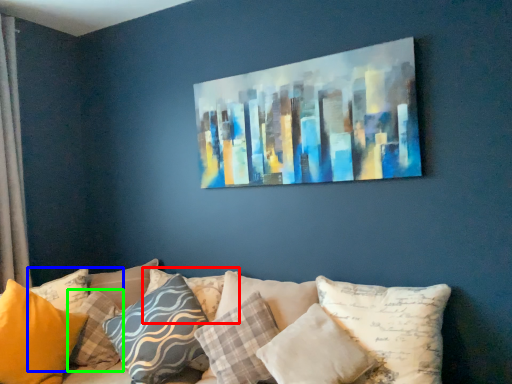
Question: Estimate the real-world distances between objects in this image. Which object is closer to pillow (highlighted by a red box), pillow (highlighted by a blue box) or pillow (highlighted by a green box)?

Choices:
 (A) pillow
 (B) pillow

Answer: (B)